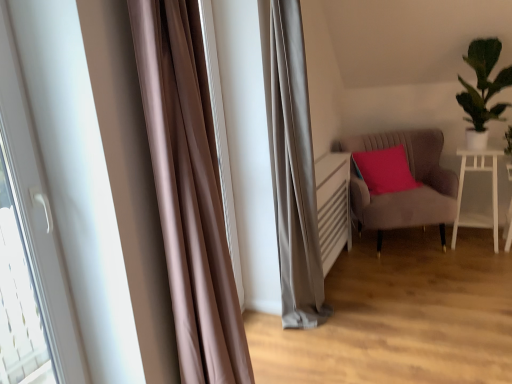
Identify the location of free space below white glossy table at right (from a real-world perspective). (471, 242).